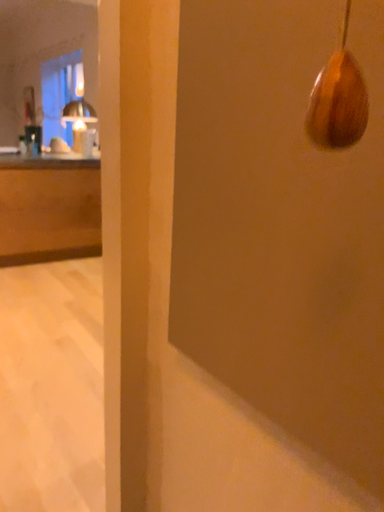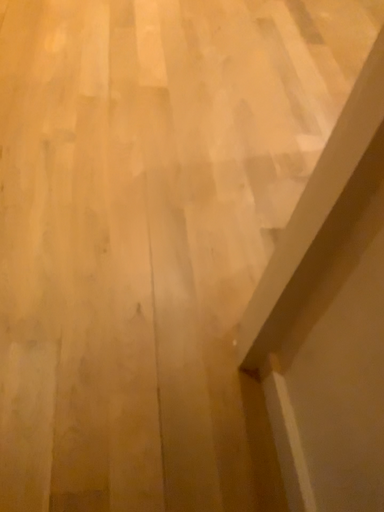
Question: How did the camera likely rotate when shooting the video?

Choices:
 (A) rotated right
 (B) rotated left

Answer: (B)